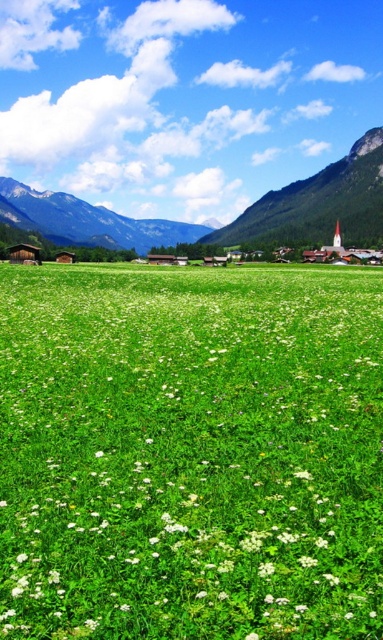
You are standing in the field of green grass and looking towards the mountains. Which mountain, the green rocky mountain at upper right or the green grassy mountain at upper left, is closer to you?

The green rocky mountain at upper right is closer to you than the green grassy mountain at upper left because it is further to the viewer.

You are a photographer planning to capture the white matte flower at center and the green grassy mountain at upper left in a single frame. Based on their sizes, which object should you focus on first to ensure both are in sharp focus?

The white matte flower at center has a smaller size compared to the green grassy mountain at upper left, so you should focus on the green grassy mountain at upper left first to ensure both are in sharp focus.

You are standing in the field and see the white matte flower at center and the green rocky mountain at upper right. Which object is positioned to the left when viewed from your perspective?

The white matte flower at center is to the left of the green rocky mountain at upper right.